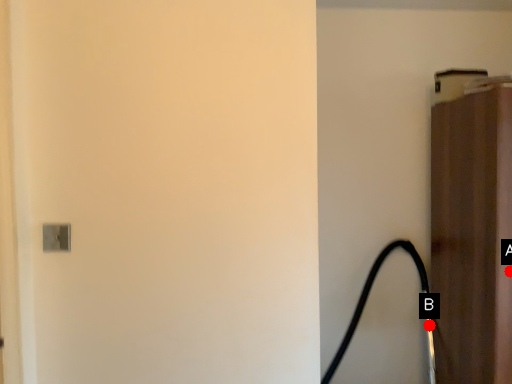
Question: Two points are circled on the image, labeled by A and B beside each circle. Which point is farther to the camera?

Choices:
 (A) A is further
 (B) B is further

Answer: (B)